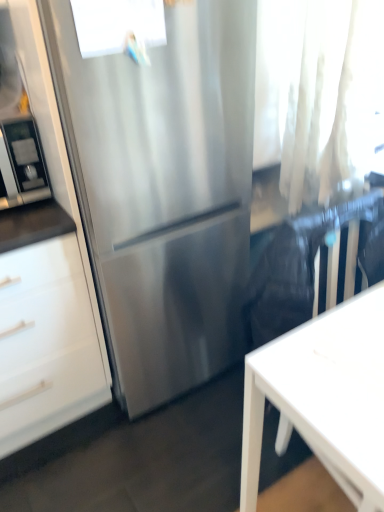
Question: Is transparent glass window at upper center in front of stainless steel refrigerator at center?

Choices:
 (A) no
 (B) yes

Answer: (A)

Question: Is transparent glass window at upper center facing towards stainless steel refrigerator at center?

Choices:
 (A) no
 (B) yes

Answer: (B)

Question: Considering the relative positions of transparent glass window at upper center and stainless steel refrigerator at center in the image provided, is transparent glass window at upper center to the right of stainless steel refrigerator at center from the viewer's perspective?

Choices:
 (A) yes
 (B) no

Answer: (B)

Question: Can you confirm if transparent glass window at upper center is smaller than stainless steel refrigerator at center?

Choices:
 (A) yes
 (B) no

Answer: (A)

Question: From the image's perspective, does transparent glass window at upper center appear higher than stainless steel refrigerator at center?

Choices:
 (A) no
 (B) yes

Answer: (B)

Question: Considering the positions of point tap(66, 95) and point tap(377, 428), is point tap(66, 95) closer or farther from the camera than point tap(377, 428)?

Choices:
 (A) farther
 (B) closer

Answer: (A)

Question: Considering the positions of stainless steel refrigerator at center and white matte desk at lower right in the image, is stainless steel refrigerator at center wider or thinner than white matte desk at lower right?

Choices:
 (A) wide
 (B) thin

Answer: (B)

Question: Is stainless steel refrigerator at center inside or outside of white matte desk at lower right?

Choices:
 (A) inside
 (B) outside

Answer: (B)

Question: From the image's perspective, is stainless steel refrigerator at center located above or below white matte desk at lower right?

Choices:
 (A) below
 (B) above

Answer: (B)

Question: From their relative heights in the image, would you say stainless steel refrigerator at center is taller or shorter than white sheer curtain at upper right?

Choices:
 (A) short
 (B) tall

Answer: (B)

Question: From a real-world perspective, relative to white sheer curtain at upper right, is stainless steel refrigerator at center vertically above or below?

Choices:
 (A) below
 (B) above

Answer: (A)

Question: In the image, is stainless steel refrigerator at center positioned in front of or behind white sheer curtain at upper right?

Choices:
 (A) front
 (B) behind

Answer: (A)

Question: Would you say stainless steel refrigerator at center is inside or outside white sheer curtain at upper right?

Choices:
 (A) inside
 (B) outside

Answer: (B)

Question: From a real-world perspective, relative to stainless steel refrigerator at left, is white sheer curtain at upper right vertically above or below?

Choices:
 (A) above
 (B) below

Answer: (A)

Question: Considering the positions of point (340, 61) and point (26, 197), is point (340, 61) closer or farther from the camera than point (26, 197)?

Choices:
 (A) closer
 (B) farther

Answer: (A)